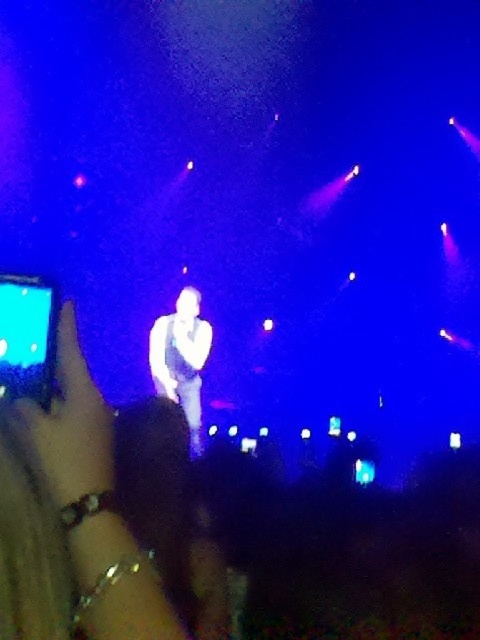
You are a photographer at the concert trying to capture the performer. You notice the white matte shirt at center and the metallic bracelet at lower left. Which object should you focus on first if you want to capture the performer from left to right?

You should focus on the white matte shirt at center first because it is to the left of the metallic bracelet at lower left, so it comes first when moving from left to right.

In the scene shown: You are a photographer at the concert. You want to capture a photo of the performer. The white matte shirt at center and metallic bracelet at lower left are both in the frame. Which object is closer to the bottom of the image?

The white matte shirt at center is positioned under the metallic bracelet at lower left, so the metallic bracelet at lower left is closer to the bottom of the image.